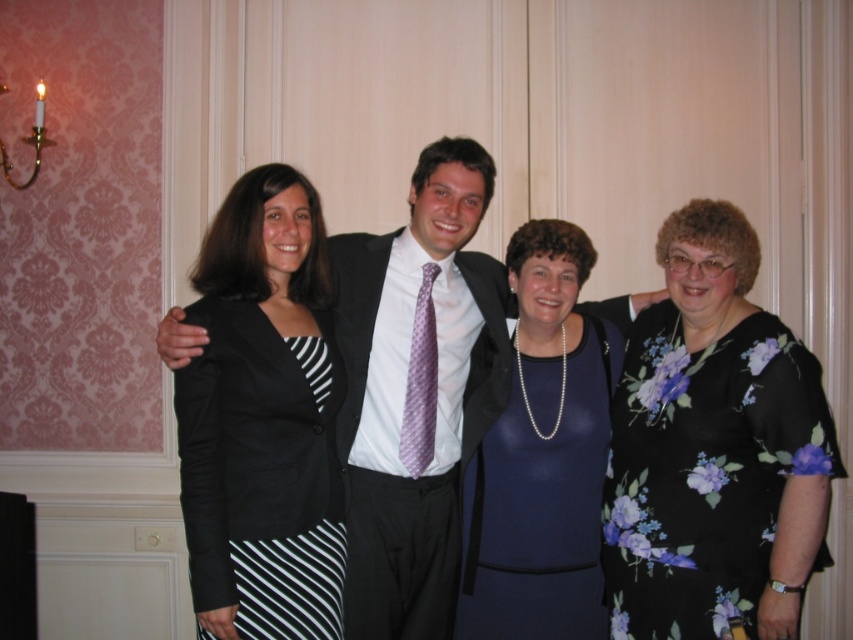
Who is taller, matte black suit at center or blue satin dress at center?

matte black suit at center is taller.

Is matte black suit at center further to the viewer compared to blue satin dress at center?

No, matte black suit at center is in front of blue satin dress at center.

Based on the photo, who is more forward, (x=363, y=413) or (x=485, y=456)?

Point (x=363, y=413) is in front.

This screenshot has width=853, height=640. Identify the location of matte black suit at center. (416, 388).

Is floral print dress at right smaller than black striped skirt at left?

No, floral print dress at right is not smaller than black striped skirt at left.

Does floral print dress at right appear on the left side of black striped skirt at left?

Incorrect, floral print dress at right is not on the left side of black striped skirt at left.

Does point (778, 632) lie in front of point (247, 449)?

No.

The image size is (853, 640). I want to click on floral print dress at right, so click(714, 449).

Which is more to the right, floral print dress at right or matte black suit at center?

floral print dress at right

Which is behind, point (782, 532) or point (387, 417)?

Point (387, 417)

The height and width of the screenshot is (640, 853). Find the location of `floral print dress at right`. floral print dress at right is located at coordinates (714, 449).